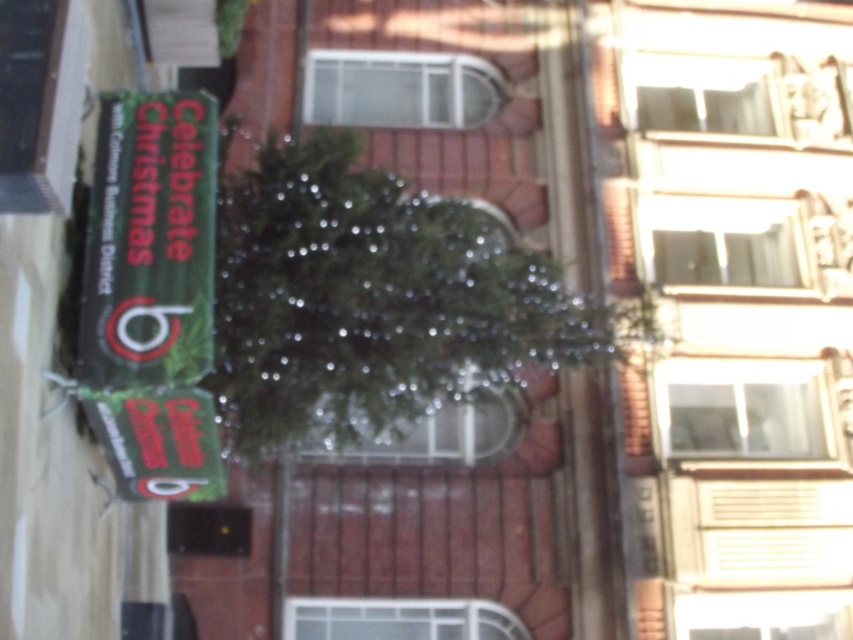
Question: Is green shiny tree at center smaller than green matte sign at upper left?

Choices:
 (A) no
 (B) yes

Answer: (A)

Question: Among these points, which one is nearest to the camera?

Choices:
 (A) (213, 369)
 (B) (192, 212)

Answer: (B)

Question: Can you confirm if green shiny tree at center is wider than green matte sign at upper left?

Choices:
 (A) no
 (B) yes

Answer: (B)

Question: Does green shiny tree at center appear on the right side of green matte sign at upper left?

Choices:
 (A) no
 (B) yes

Answer: (B)

Question: Which point is closer to the camera?

Choices:
 (A) (234, 326)
 (B) (180, 291)

Answer: (B)